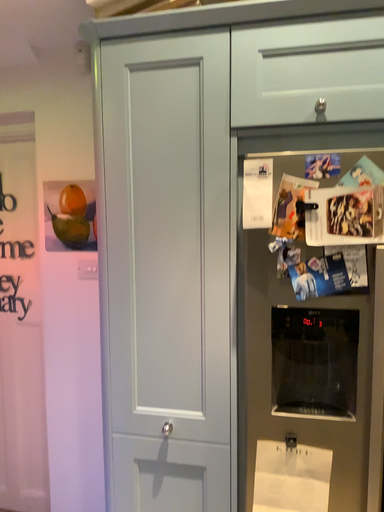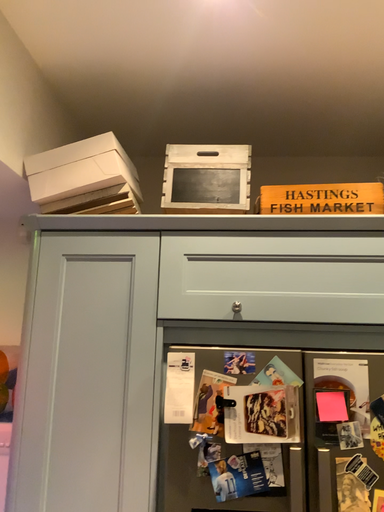
Question: Which way did the camera rotate in the video?

Choices:
 (A) rotated right
 (B) rotated left

Answer: (A)